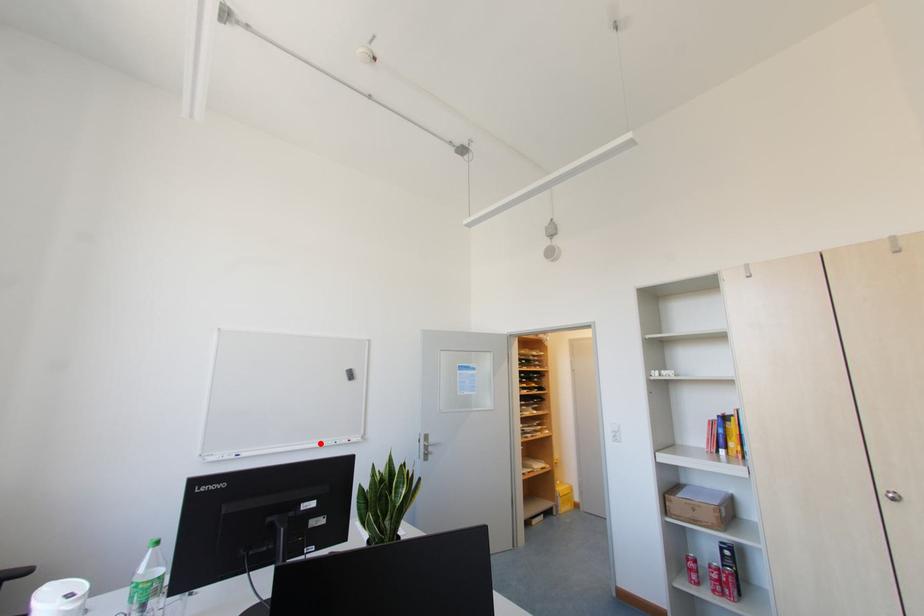
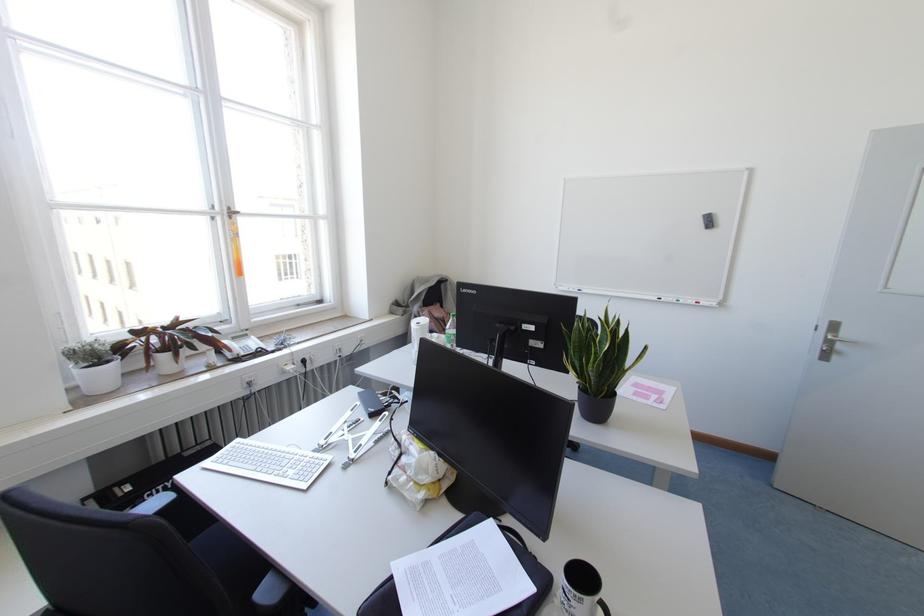
The point at the highlighted location is marked in the first image. Where is the corresponding point in the second image?

(659, 299)